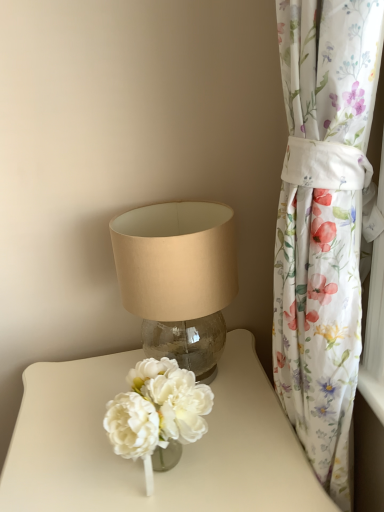
Question: From a real-world perspective, is beige fabric lampshade at center located higher than floral fabric curtain at right?

Choices:
 (A) no
 (B) yes

Answer: (B)

Question: Is beige fabric lampshade at center aimed at floral fabric curtain at right?

Choices:
 (A) yes
 (B) no

Answer: (B)

Question: Does beige fabric lampshade at center lie in front of floral fabric curtain at right?

Choices:
 (A) no
 (B) yes

Answer: (A)

Question: From the image's perspective, is beige fabric lampshade at center above floral fabric curtain at right?

Choices:
 (A) yes
 (B) no

Answer: (A)

Question: From a real-world perspective, does beige fabric lampshade at center sit lower than floral fabric curtain at right?

Choices:
 (A) no
 (B) yes

Answer: (A)

Question: From a real-world perspective, is beige fabric lampshade at center physically located above or below floral fabric curtain at right?

Choices:
 (A) below
 (B) above

Answer: (B)

Question: Is beige fabric lampshade at center to the left or to the right of floral fabric curtain at right in the image?

Choices:
 (A) left
 (B) right

Answer: (A)

Question: Relative to floral fabric curtain at right, is beige fabric lampshade at center in front or behind?

Choices:
 (A) behind
 (B) front

Answer: (A)

Question: Choose the correct answer: Is beige fabric lampshade at center inside floral fabric curtain at right or outside it?

Choices:
 (A) outside
 (B) inside

Answer: (A)

Question: Based on their positions, is translucent glass vase at center located to the left or right of beige fabric lampshade at center?

Choices:
 (A) right
 (B) left

Answer: (B)

Question: From a real-world perspective, is translucent glass vase at center above or below beige fabric lampshade at center?

Choices:
 (A) above
 (B) below

Answer: (B)

Question: Would you say translucent glass vase at center is inside or outside beige fabric lampshade at center?

Choices:
 (A) outside
 (B) inside

Answer: (A)

Question: Considering the positions of translucent glass vase at center and beige fabric lampshade at center in the image, is translucent glass vase at center taller or shorter than beige fabric lampshade at center?

Choices:
 (A) tall
 (B) short

Answer: (A)

Question: Relative to floral fabric curtain at right, is translucent glass vase at center in front or behind?

Choices:
 (A) front
 (B) behind

Answer: (B)

Question: From the image's perspective, is translucent glass vase at center positioned above or below floral fabric curtain at right?

Choices:
 (A) below
 (B) above

Answer: (A)